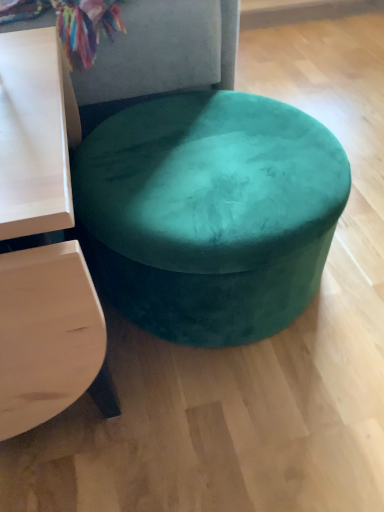
Locate an element on the screen. vacant space situated above teal velvet ottoman at center (from a real-world perspective) is located at coordinates (213, 154).